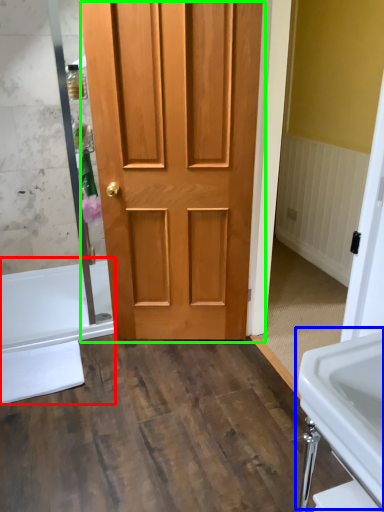
Question: Which is nearer to the bath (highlighted by a red box)? sink (highlighted by a blue box) or door (highlighted by a green box).

Choices:
 (A) sink
 (B) door

Answer: (B)